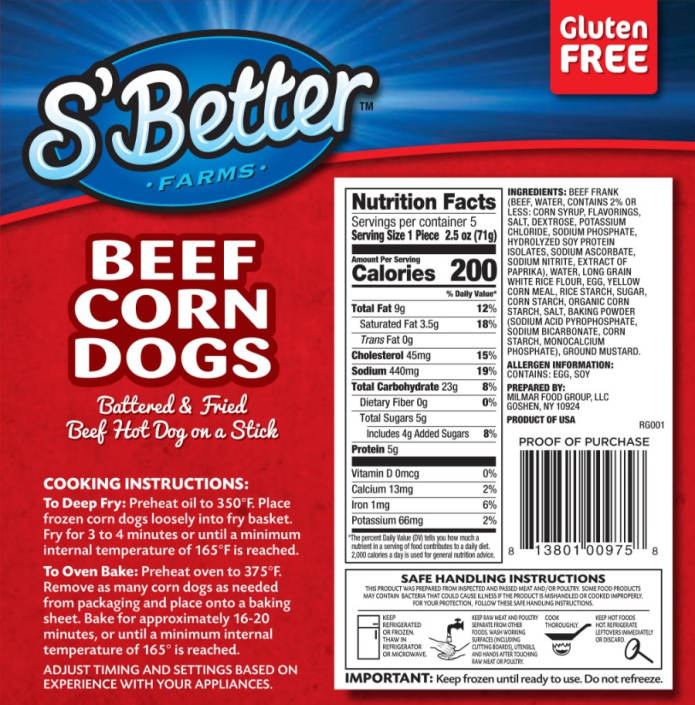
The height and width of the screenshot is (705, 695). In order to click on frying pan icon in this screenshot , I will do `click(575, 642)`.